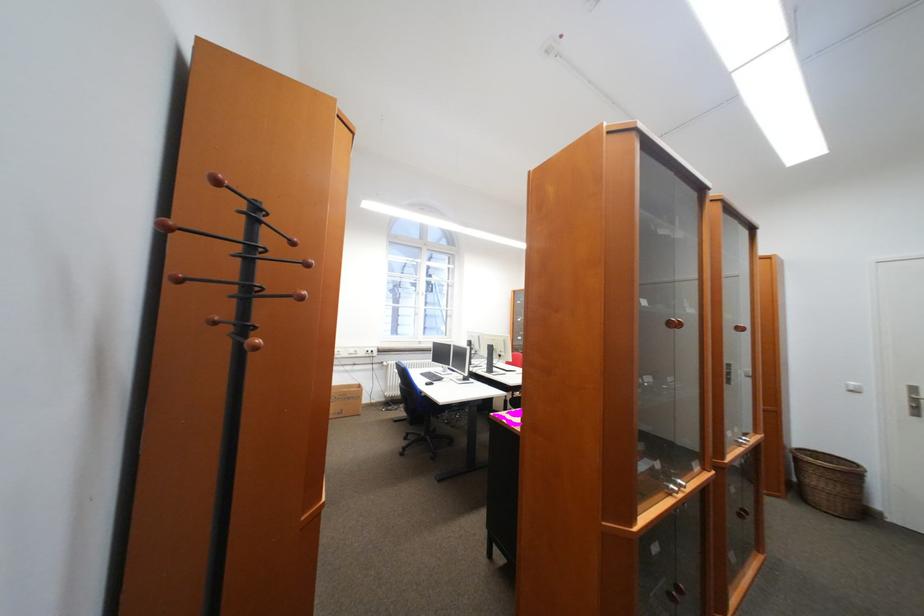
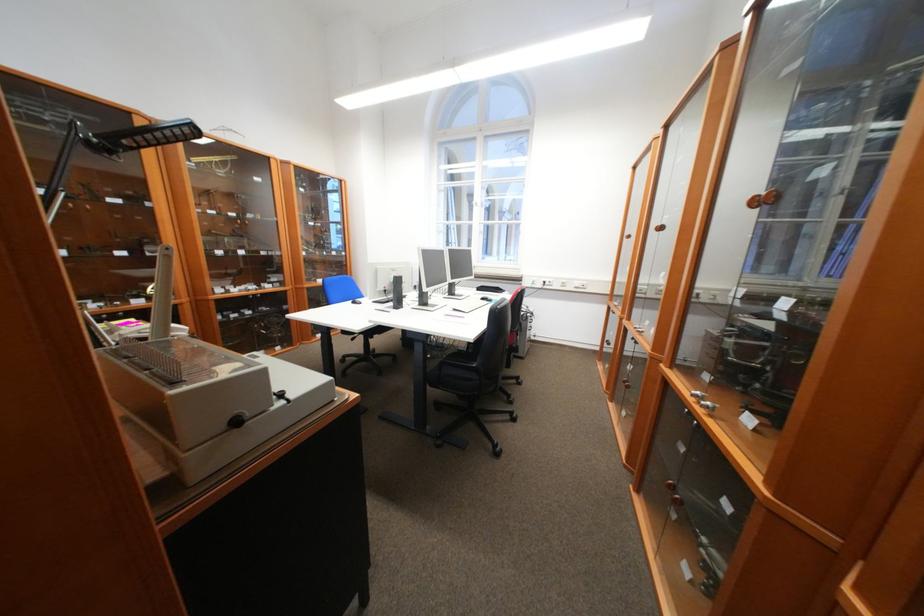
Question: I am providing you with two images of the same scene from different viewpoints. Which of the following objects are not visible in image2?

Choices:
 (A) white power outlet
 (B) computer mouse
 (C) green eyewash paddle
 (D) black chair sitting surface

Answer: (B)